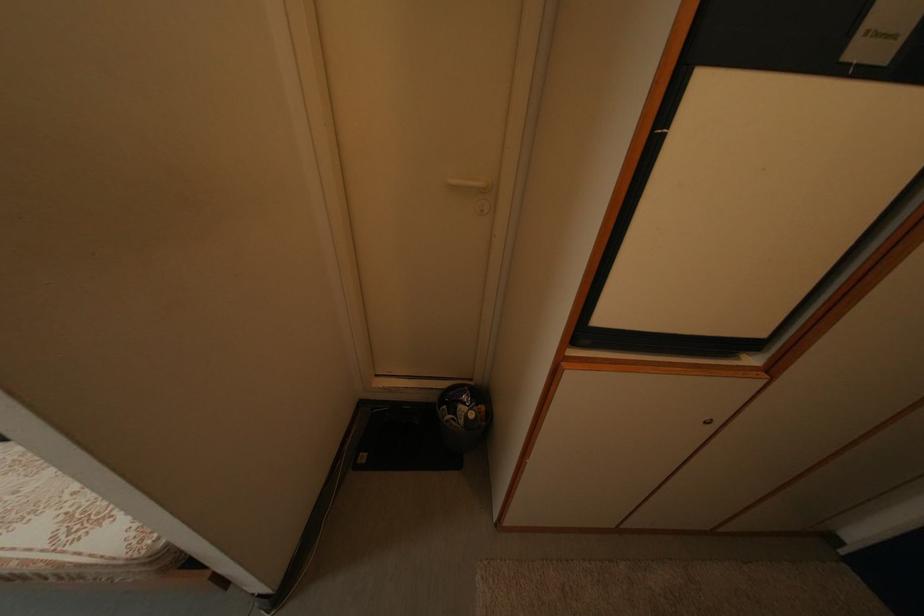
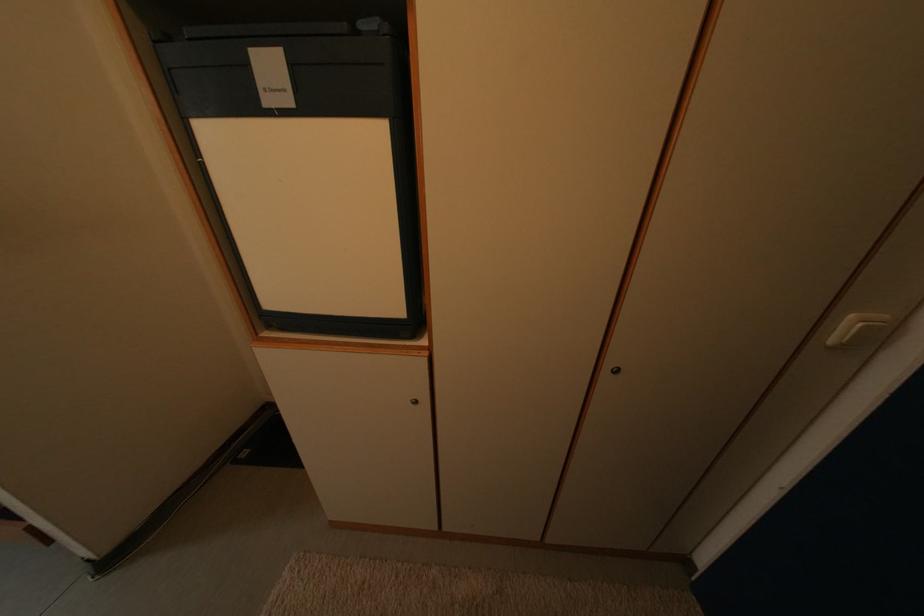
Question: The images are taken continuously from a first-person perspective. In which direction are you moving?

Choices:
 (A) Left
 (B) Right
 (C) Forward
 (D) Backward

Answer: (B)